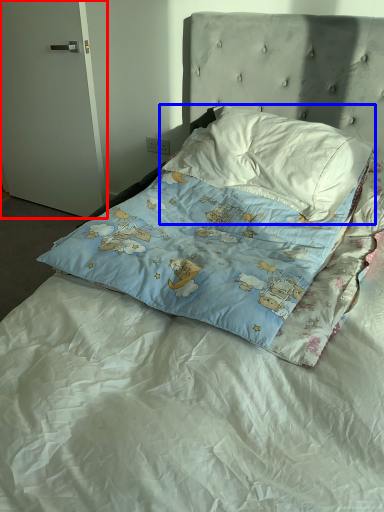
Question: Which point is closer to the camera, door (highlighted by a red box) or pillow (highlighted by a blue box)?

Choices:
 (A) door
 (B) pillow

Answer: (B)